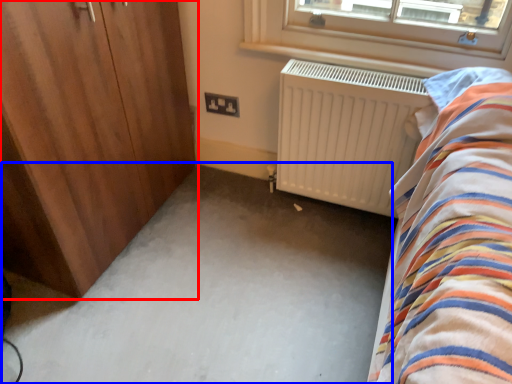
Question: Which point is closer to the camera, door (highlighted by a red box) or plain (highlighted by a blue box)?

Choices:
 (A) door
 (B) plain

Answer: (A)